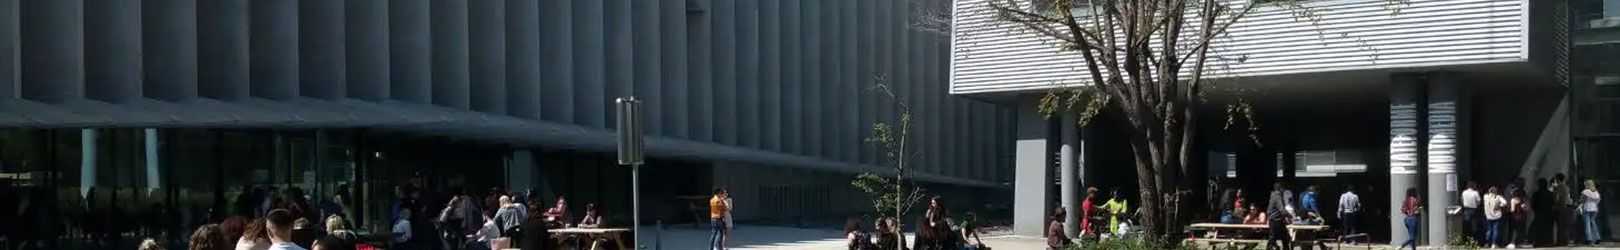
In order to click on windows in this screenshot , I will do `click(49, 172)`, `click(181, 158)`, `click(306, 163)`, `click(352, 171)`, `click(1597, 156)`.